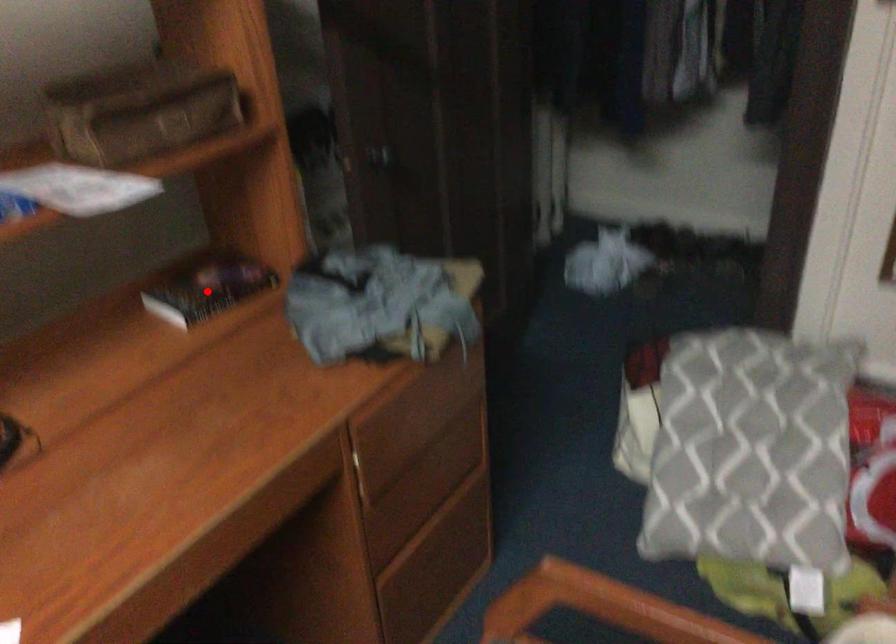
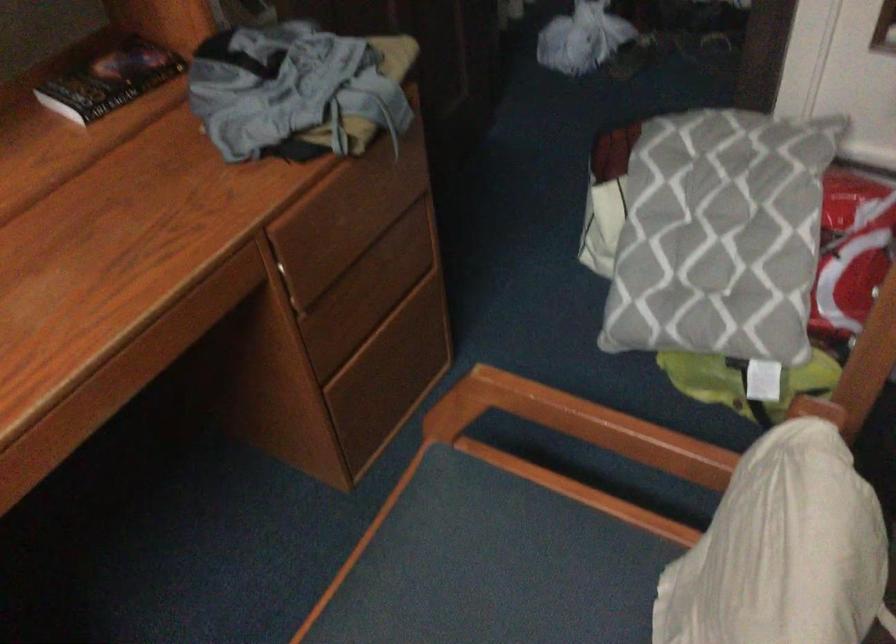
Question: I am providing you with two images of the same scene from different viewpoints. In image1, a red point is highlighted. Considering the same 3D point in image2, which of the following is correct?

Choices:
 (A) It is closer
 (B) It is farther

Answer: (A)